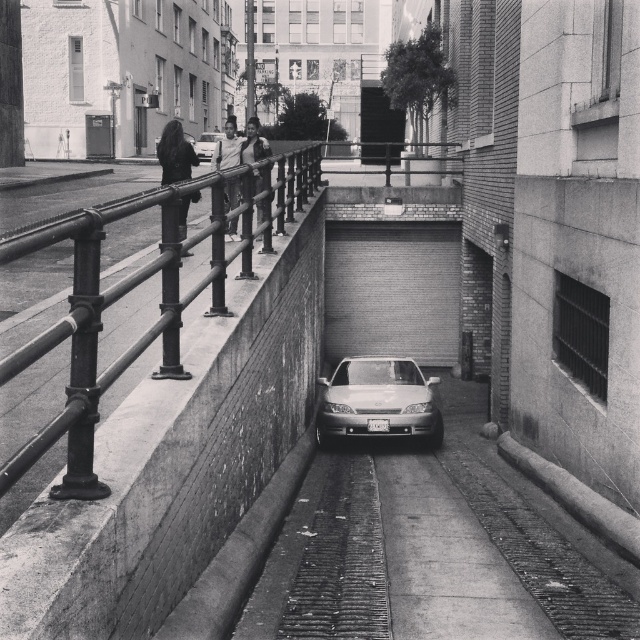
Question: Can you confirm if black metal railing at upper left is positioned above silver metallic sedan at center?

Choices:
 (A) no
 (B) yes

Answer: (B)

Question: Which object appears closest to the camera in this image?

Choices:
 (A) black metal railing at upper left
 (B) silver metallic sedan at center
 (C) shiny silver sedan at center

Answer: (A)

Question: Which of the following is the farthest from the observer?

Choices:
 (A) silver metallic sedan at center
 (B) shiny silver sedan at center
 (C) black metal railing at upper left

Answer: (A)

Question: Is black metal railing at upper left positioned at the back of shiny silver sedan at center?

Choices:
 (A) yes
 (B) no

Answer: (B)

Question: Is black metal railing at upper left in front of shiny silver sedan at center?

Choices:
 (A) no
 (B) yes

Answer: (B)

Question: Which point is farther to the camera?

Choices:
 (A) shiny silver sedan at center
 (B) silver metallic sedan at center

Answer: (B)